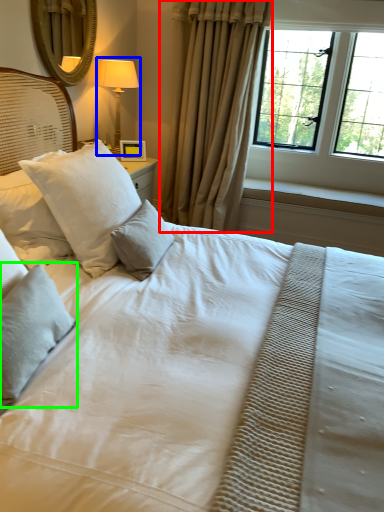
Question: Estimate the real-world distances between objects in this image. Which object is farther from curtain (highlighted by a red box), bedside lamp (highlighted by a blue box) or pillow (highlighted by a green box)?

Choices:
 (A) bedside lamp
 (B) pillow

Answer: (B)